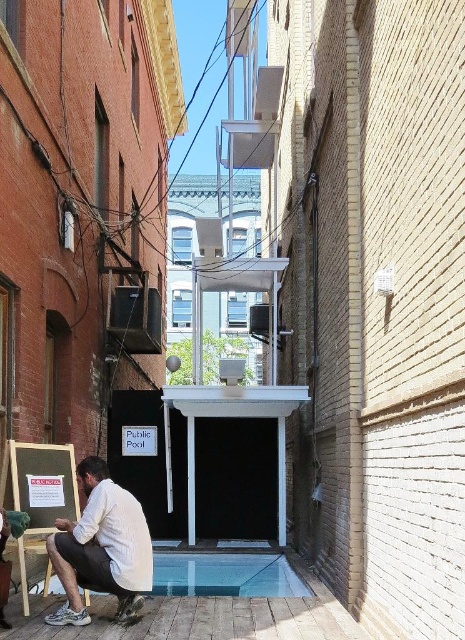
Question: Can you confirm if white cotton shirt at lower center is wider than transparent glass pool at lower center?

Choices:
 (A) yes
 (B) no

Answer: (B)

Question: Based on their relative distances, which object is nearer to the transparent glass pool at lower center?

Choices:
 (A) wooden easel at lower left
 (B) white cotton shirt at lower center

Answer: (A)

Question: Which of these objects is positioned closest to the transparent glass pool at lower center?

Choices:
 (A) wooden easel at lower left
 (B) white cotton shirt at lower center

Answer: (A)

Question: Does transparent glass pool at lower center have a greater width compared to wooden easel at lower left?

Choices:
 (A) no
 (B) yes

Answer: (B)

Question: Is transparent glass pool at lower center below wooden easel at lower left?

Choices:
 (A) yes
 (B) no

Answer: (A)

Question: Among these objects, which one is farthest from the camera?

Choices:
 (A) transparent glass pool at lower center
 (B) white cotton shirt at lower center
 (C) wooden easel at lower left

Answer: (A)